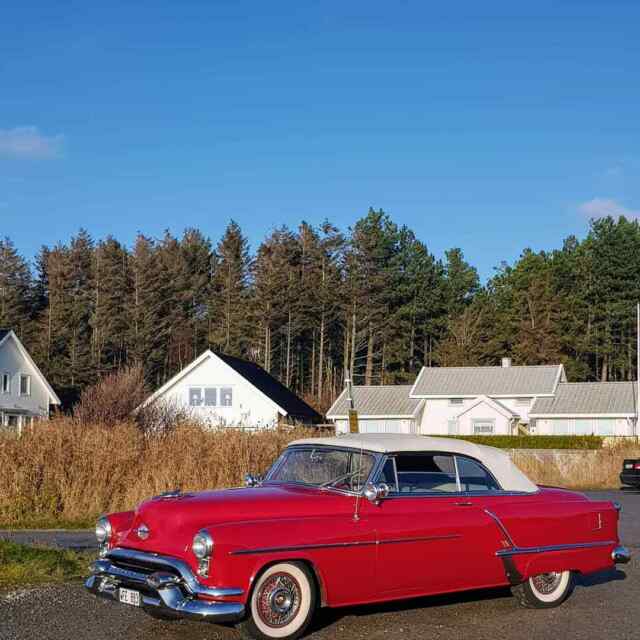
Find the location of `light bulb`. light bulb is located at coordinates tap(195, 532).